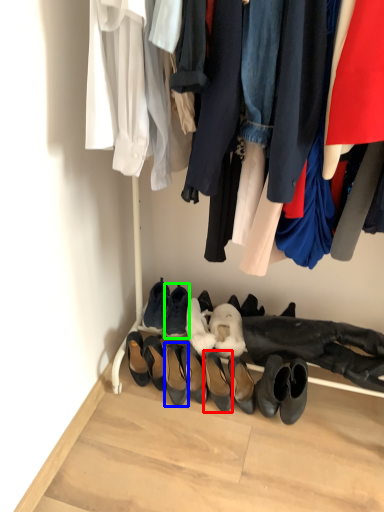
Question: Based on their relative distances, which object is nearer to footwear (highlighted by a red box)? Choose from footwear (highlighted by a blue box) and footwear (highlighted by a green box).

Choices:
 (A) footwear
 (B) footwear

Answer: (A)